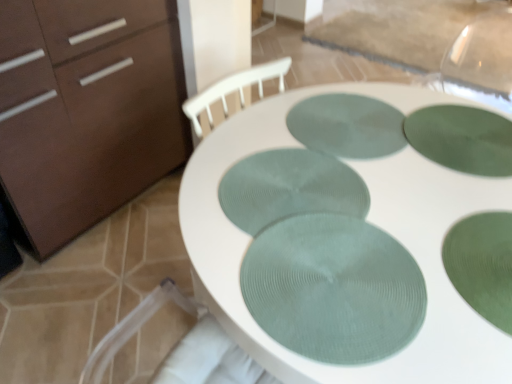
Find the location of `empty space that is in between green textured glass at center, positioned as the fourth glass plate in back-to-front order, and green textured glass plate at center, placed as the fifth glass plate when sorted from back to front`. empty space that is in between green textured glass at center, positioned as the fourth glass plate in back-to-front order, and green textured glass plate at center, placed as the fifth glass plate when sorted from back to front is located at coordinates (420, 262).